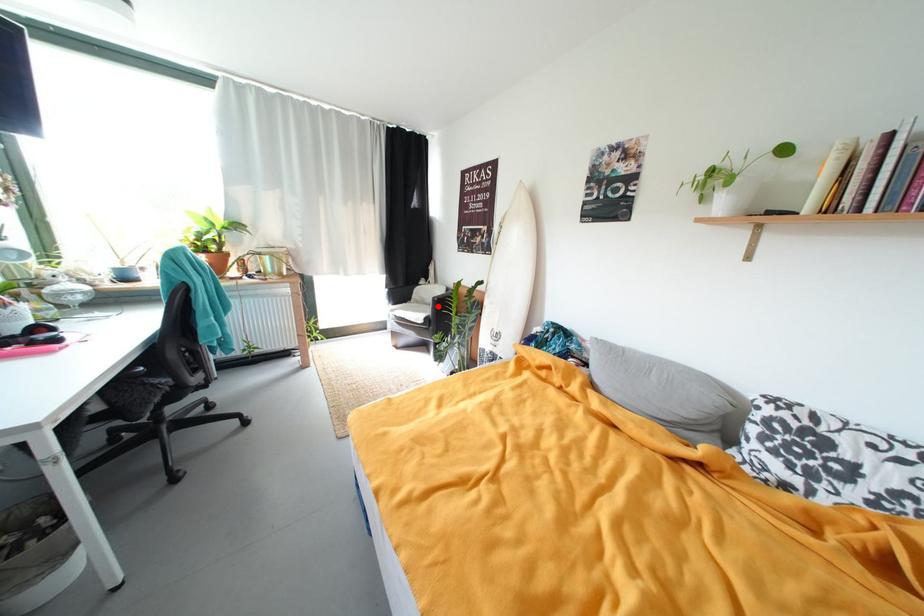
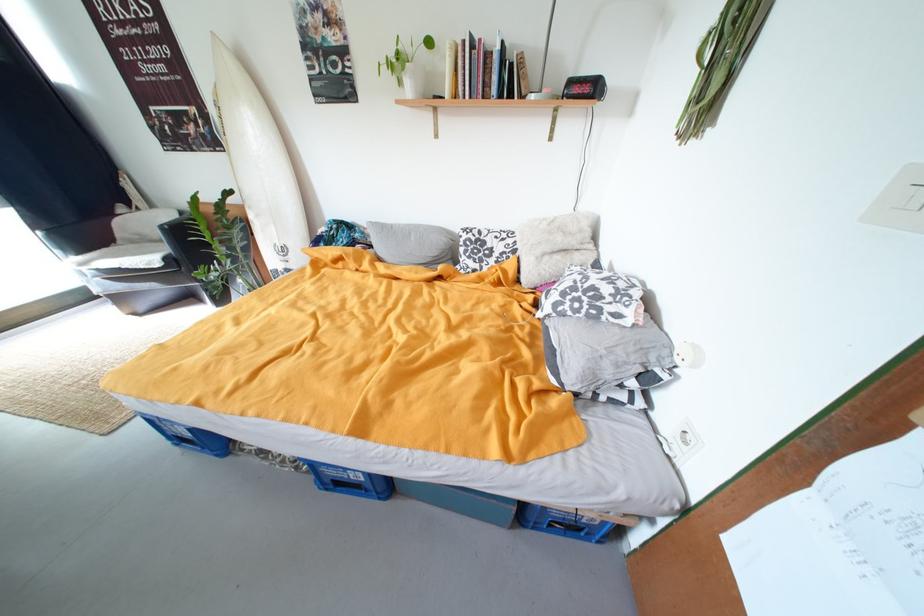
The point at the highlighted location is marked in the first image. Where is the corresponding point in the second image?

(169, 243)